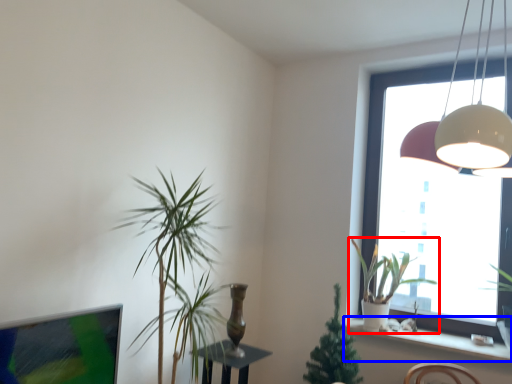
Question: Which of the following is the closest to the observer, houseplant (highlighted by a red box) or window sill (highlighted by a blue box)?

Choices:
 (A) houseplant
 (B) window sill

Answer: (B)